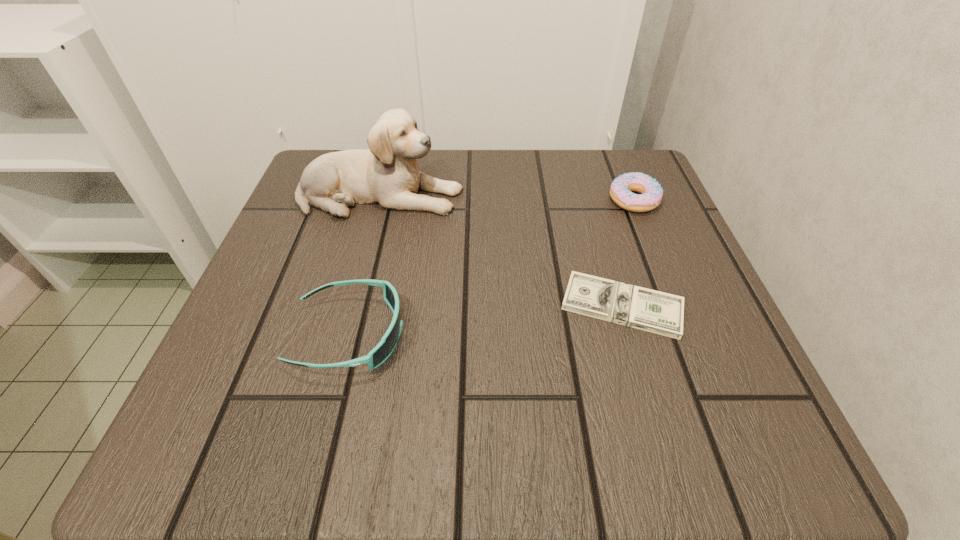
Locate an element on the screen. Image resolution: width=960 pixels, height=540 pixels. the tallest object is located at coordinates (387, 173).

The width and height of the screenshot is (960, 540). What are the coordinates of `the third shortest object` in the screenshot? It's located at (378, 355).

Where is `the second shortest object`? This screenshot has height=540, width=960. the second shortest object is located at coordinates (651, 192).

Locate an element on the screen. the shortest object is located at coordinates (661, 313).

The width and height of the screenshot is (960, 540). What are the coordinates of `vacant space located 0.200m on the front-facing side of the tallest object` in the screenshot? It's located at (562, 196).

Find the location of a particular element. Image resolution: width=960 pixels, height=540 pixels. free space located on the front-facing side of the second tallest object is located at coordinates (620, 335).

Where is `vacant space located on the left of the third tallest object`? This screenshot has height=540, width=960. vacant space located on the left of the third tallest object is located at coordinates (540, 200).

At what (x,y) coordinates should I click in order to perform the action: click on vacant region located on the left of the shortest object. Please return your answer as a coordinate pair (x, y). The image size is (960, 540). Looking at the image, I should click on (371, 306).

Find the location of a particular element. This screenshot has height=540, width=960. puppy located at the far edge is located at coordinates [387, 173].

I want to click on doughnut that is at the far edge, so click(651, 192).